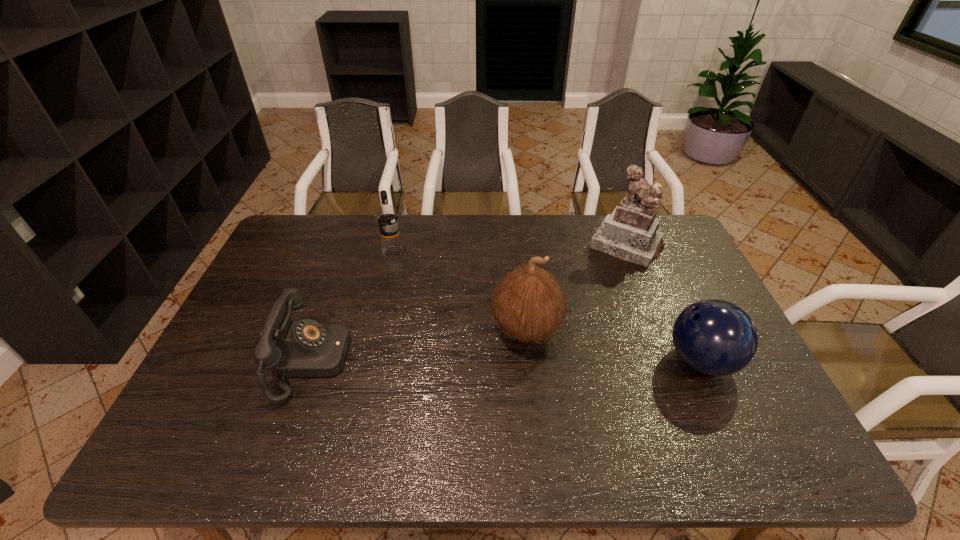
This screenshot has width=960, height=540. I want to click on empty location between the second object from left to right and the coconut, so click(460, 291).

At what (x,y) coordinates should I click in order to perform the action: click on free space between the telephone and the bowling ball. Please return your answer as a coordinate pair (x, y). Looking at the image, I should click on (506, 361).

Find the location of a particular element. The image size is (960, 540). the closest object to the shortest object is located at coordinates (387, 217).

At what (x,y) coordinates should I click in order to perform the action: click on object that is the second closest to the figurine. Please return your answer as a coordinate pair (x, y). Looking at the image, I should click on (714, 337).

At what (x,y) coordinates should I click in order to perform the action: click on vacant space that satisfies the following two spatial constraints: 1. on the back side of the third object from right to left; 2. on the left side of the figurine. Please return your answer as a coordinate pair (x, y). This screenshot has width=960, height=540. Looking at the image, I should click on (518, 245).

Identify the location of vacant space that satisfies the following two spatial constraints: 1. on the front side of the bowling ball; 2. on the surface of the third object from right to left near the finger holes. This screenshot has width=960, height=540. (530, 361).

Identify the location of blank space that satisfies the following two spatial constraints: 1. on the front side of the vodka; 2. on the right side of the third object from right to left. The image size is (960, 540). (375, 329).

Locate an element on the screen. The width and height of the screenshot is (960, 540). vacant area that satisfies the following two spatial constraints: 1. on the front side of the bowling ball; 2. on the surface of the figurine near the finger holes is located at coordinates (673, 361).